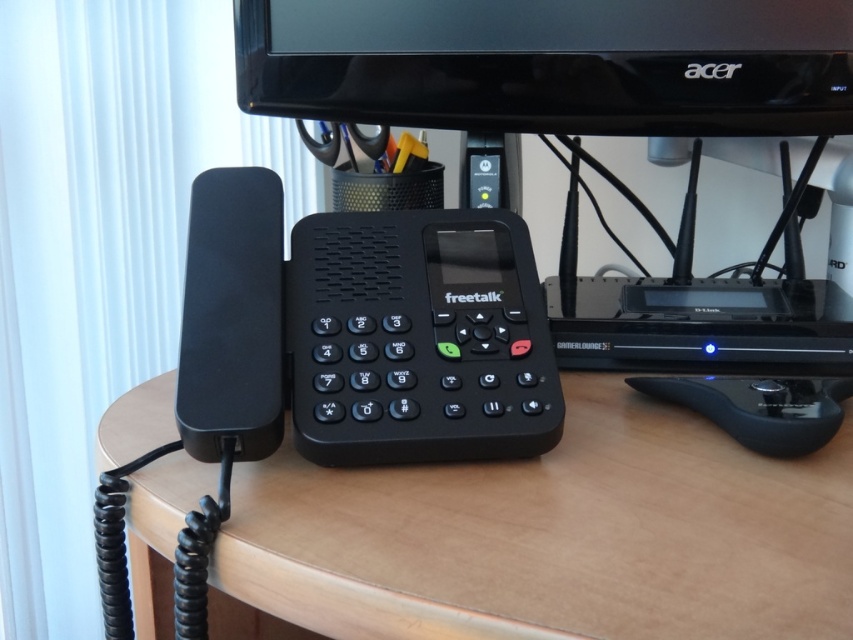
Which is above, black plastic phone at center or black matte speaker at left?

black matte speaker at left is above.

Does point (537, 388) come behind point (225, 195)?

No, it is not.

What do you see at coordinates (416, 339) in the screenshot? The image size is (853, 640). I see `black plastic phone at center` at bounding box center [416, 339].

This screenshot has height=640, width=853. I want to click on black plastic phone at center, so click(x=416, y=339).

Who is shorter, black glossy monitor at upper center or black matte mouse at lower right?

Standing shorter between the two is black matte mouse at lower right.

Between black glossy monitor at upper center and black matte mouse at lower right, which one is positioned lower?

black matte mouse at lower right

Who is more forward, (666,45) or (653,388)?

Positioned in front is point (653,388).

The height and width of the screenshot is (640, 853). What are the coordinates of `black glossy monitor at upper center` in the screenshot? It's located at (552, 65).

Is wooden at center taller than black plastic phone at center?

Indeed, wooden at center has a greater height compared to black plastic phone at center.

Does point (213, 472) come farther from viewer compared to point (457, 228)?

No, it is in front of (457, 228).

Is point (490, 628) farther from camera compared to point (416, 328)?

No, (490, 628) is in front of (416, 328).

The height and width of the screenshot is (640, 853). What are the coordinates of `wooden at center` in the screenshot? It's located at (554, 536).